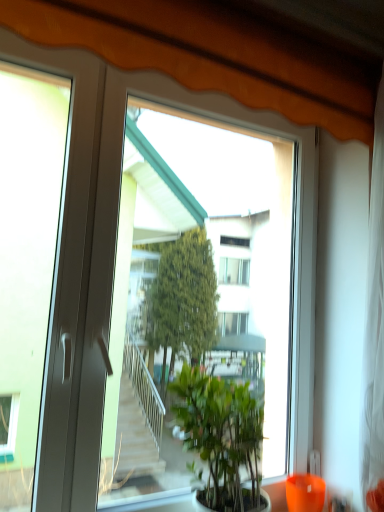
Measure the distance between green leafy plant at center and camera.

green leafy plant at center and camera are 4.05 feet apart.

Where is `green leafy plant at center`? The width and height of the screenshot is (384, 512). green leafy plant at center is located at coordinates (221, 436).

Can you tell me how much transparent glass window at center and orange glass vase at lower right differ in facing direction?

0.567 degrees.

Which is farther from the camera, (x=185, y=345) or (x=309, y=504)?

The point (x=185, y=345) is farther.

Locate an element on the screen. Image resolution: width=384 pixels, height=512 pixels. window screen above the orange glass vase at lower right (from the image's perspective) is located at coordinates (186, 279).

Is transparent glass window at center wider or thinner than orange glass vase at lower right?

Considering their sizes, transparent glass window at center looks slimmer than orange glass vase at lower right.

Is green leafy plant at center oriented away from orange glass vase at lower right?

No, green leafy plant at center is not facing the opposite direction of orange glass vase at lower right.

How distant is green leafy plant at center from orange glass vase at lower right?

green leafy plant at center is 17.88 inches away from orange glass vase at lower right.

Considering the relative sizes of green leafy plant at center and orange glass vase at lower right in the image provided, is green leafy plant at center bigger than orange glass vase at lower right?

Indeed, green leafy plant at center has a larger size compared to orange glass vase at lower right.

Is green leafy plant at center far from transparent glass window at center?

green leafy plant at center is actually quite close to transparent glass window at center.

Is green leafy plant at center to the right of transparent glass window at center from the viewer's perspective?

Correct, you'll find green leafy plant at center to the right of transparent glass window at center.

Which is in front, green leafy plant at center or transparent glass window at center?

transparent glass window at center is closer to the camera.

What's the angular difference between green leafy plant at center and transparent glass window at center's facing directions?

The angular difference between green leafy plant at center and transparent glass window at center is 0.567 degrees.

Is orange glass vase at lower right with green leafy plant at center?

No, orange glass vase at lower right is not next to green leafy plant at center.

Consider the image. Measure the distance from orange glass vase at lower right to green leafy plant at center.

orange glass vase at lower right is 17.88 inches from green leafy plant at center.

Looking at this image, does orange glass vase at lower right have a lesser height compared to green leafy plant at center?

Yes, orange glass vase at lower right is shorter than green leafy plant at center.

Does orange glass vase at lower right turn towards green leafy plant at center?

No, orange glass vase at lower right does not turn towards green leafy plant at center.

From the image's perspective, is transparent glass window at center positioned above or below green leafy plant at center?

Clearly, from the image's perspective, transparent glass window at center is above green leafy plant at center.

Can you confirm if transparent glass window at center is positioned to the left of green leafy plant at center?

Correct, you'll find transparent glass window at center to the left of green leafy plant at center.

Is transparent glass window at center behind green leafy plant at center?

No, it is in front of green leafy plant at center.

Is transparent glass window at center looking in the opposite direction of green leafy plant at center?

Absolutely, transparent glass window at center is directed away from green leafy plant at center.

Looking at this image, is orange glass vase at lower right far from transparent glass window at center?

They are positioned close to each other.

From a real-world perspective, is orange glass vase at lower right positioned above or below transparent glass window at center?

Clearly, from a real-world perspective, orange glass vase at lower right is below transparent glass window at center.

Is orange glass vase at lower right situated inside transparent glass window at center or outside?

orange glass vase at lower right is not inside transparent glass window at center, it's outside.

From the image's perspective, which object appears higher, orange glass vase at lower right or transparent glass window at center?

transparent glass window at center is shown above in the image.

You are a GUI agent. You are given a task and a screenshot of the screen. Output one action in this format:
    pyautogui.click(x=<x>, y=<y>)
    Task: Click on the window screen on the left of orange glass vase at lower right
    The image size is (384, 512).
    Given the screenshot: What is the action you would take?
    pyautogui.click(x=186, y=279)

Where is `houseplant in front of the orange glass vase at lower right`? houseplant in front of the orange glass vase at lower right is located at coordinates (221, 436).

Considering their positions, is orange glass vase at lower right positioned further to green leafy plant at center than transparent glass window at center?

orange glass vase at lower right is positioned further to the anchor green leafy plant at center.

Estimate the real-world distances between objects in this image. Which object is closer to transparent glass window at center, orange glass vase at lower right or green leafy plant at center?

Among the two, green leafy plant at center is located nearer to transparent glass window at center.

Which object lies further to the anchor point green leafy plant at center, transparent glass window at center or orange glass vase at lower right?

orange glass vase at lower right lies further to green leafy plant at center than the other object.

When comparing their distances from transparent glass window at center, does green leafy plant at center or orange glass vase at lower right seem closer?

green leafy plant at center lies closer to transparent glass window at center than the other object.

Based on their spatial positions, is green leafy plant at center or transparent glass window at center further from orange glass vase at lower right?

transparent glass window at center is further to orange glass vase at lower right.

When comparing their distances from orange glass vase at lower right, does transparent glass window at center or green leafy plant at center seem closer?

The object closer to orange glass vase at lower right is green leafy plant at center.

The width and height of the screenshot is (384, 512). In order to click on houseplant that lies between transparent glass window at center and orange glass vase at lower right from top to bottom in this screenshot , I will do `click(221, 436)`.